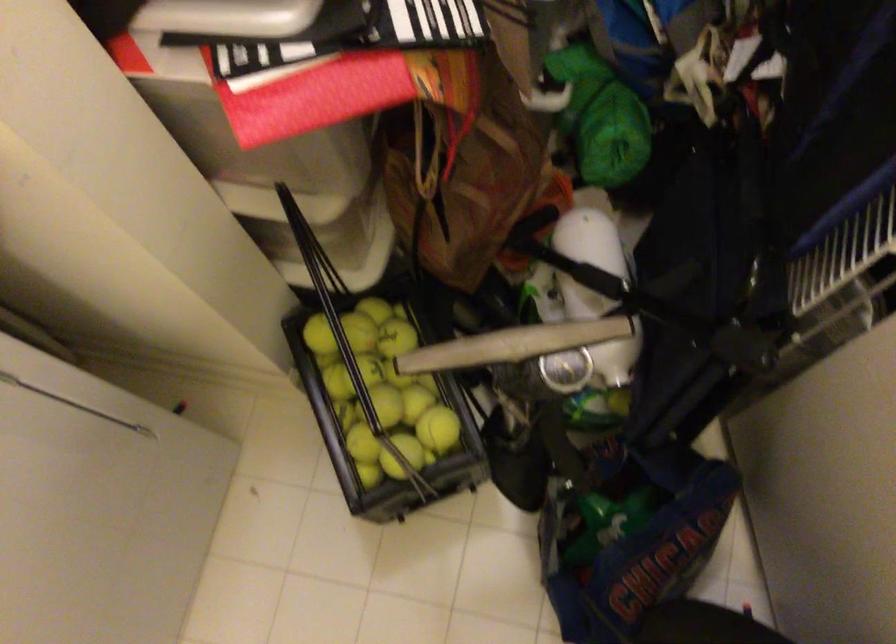
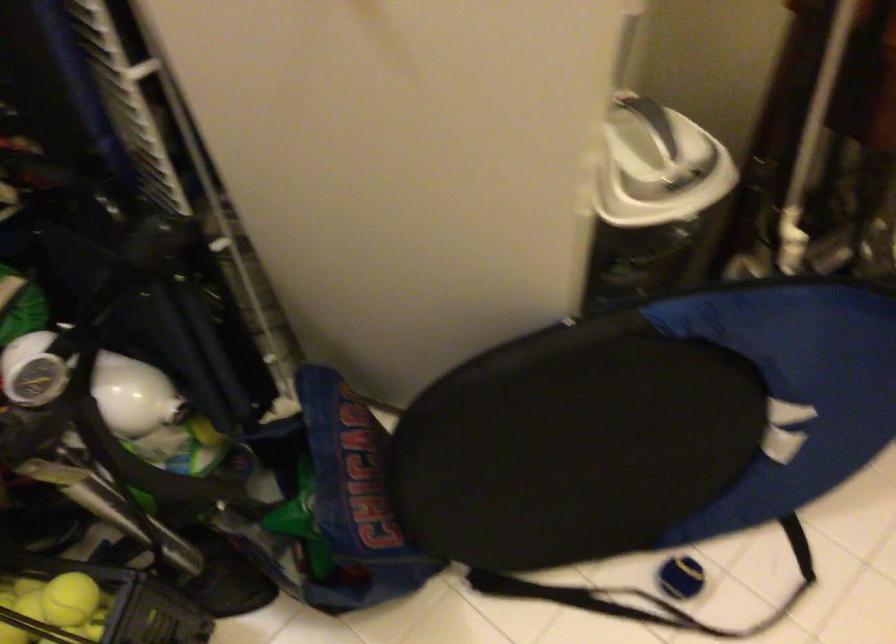
Question: The first image is from the beginning of the video and the second image is from the end. How did the camera likely rotate when shooting the video?

Choices:
 (A) Left
 (B) Right
 (C) Up
 (D) Down

Answer: (B)